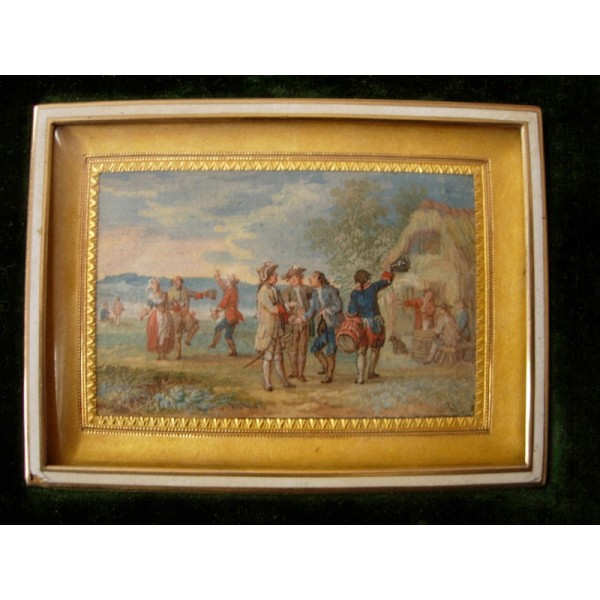
This screenshot has width=600, height=600. Find the location of `window`. window is located at coordinates (421, 242).